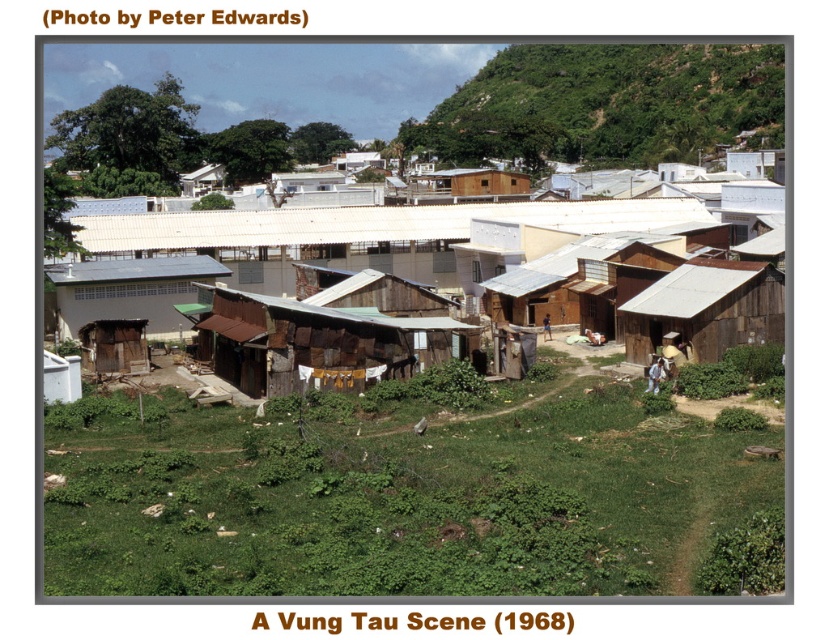
You are standing at the point labeled as point (640, 353) and want to move towards the point labeled as point (606, 112). Which direction should you move to get closer to your destination?

To move from point (640, 353) towards point (606, 112), you should move to the left and slightly forward since point (606, 112) is closer to the viewer than point (640, 353).